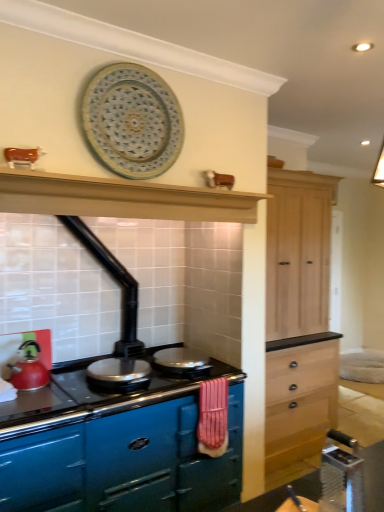
At what (x,y) coordinates should I click in order to perform the action: click on free space above matte black exhaust hood at upper center (from a real-world perspective). Please return your answer as a coordinate pair (x, y). The height and width of the screenshot is (512, 384). Looking at the image, I should click on (146, 183).